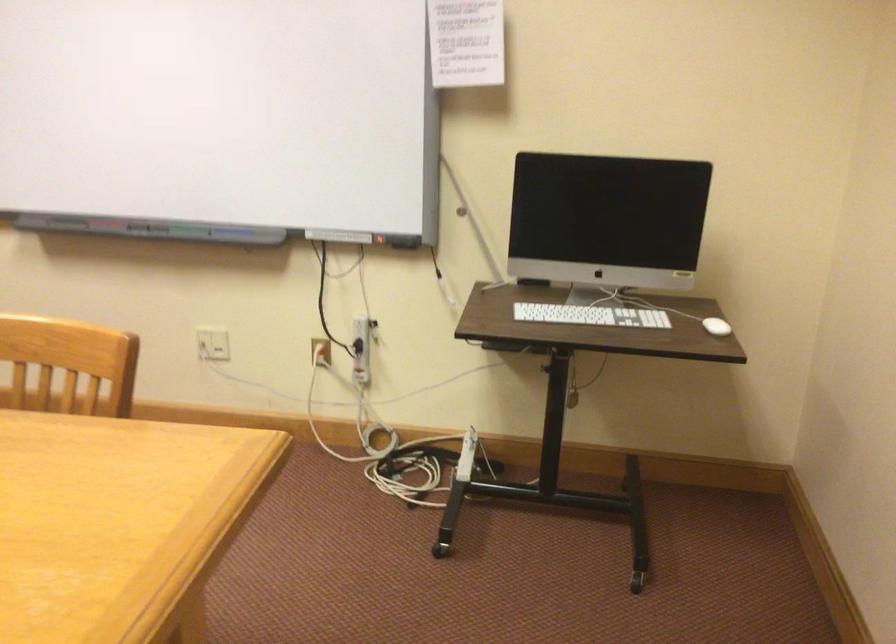
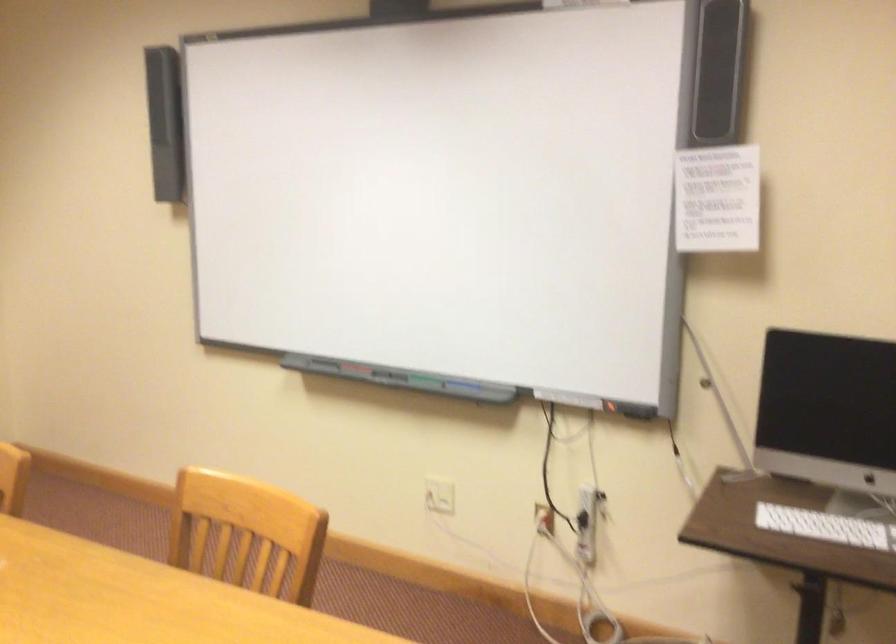
Question: How did the camera likely rotate?

Choices:
 (A) Left
 (B) Right
 (C) Up
 (D) Down

Answer: (A)